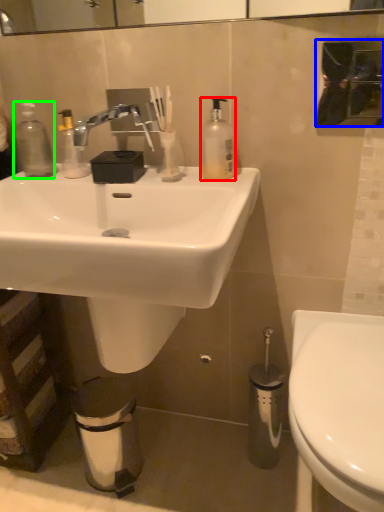
Question: Which object is the farthest from soap dispenser (highlighted by a red box)? Choose among these: mirror (highlighted by a blue box) or bottle (highlighted by a green box).

Choices:
 (A) mirror
 (B) bottle

Answer: (B)